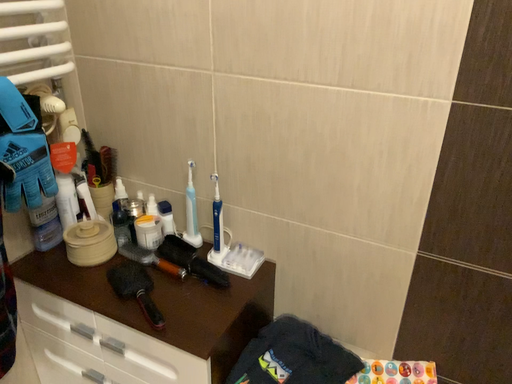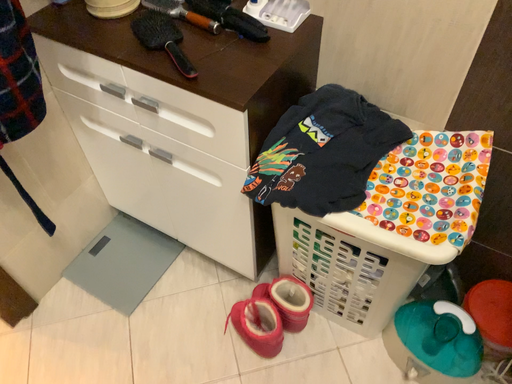
Question: How did the camera likely rotate when shooting the video?

Choices:
 (A) rotated upward
 (B) rotated downward

Answer: (B)